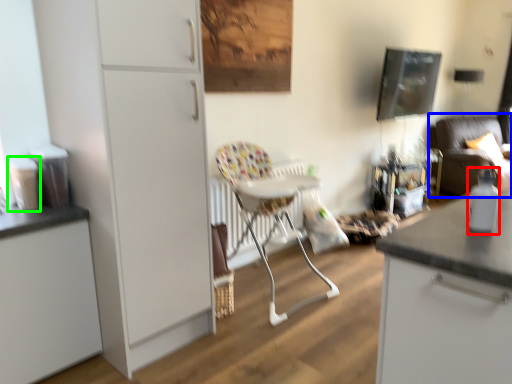
Question: Which object is the closest to the bottle (highlighted by a red box)? Choose among these: studio couch (highlighted by a blue box) or appliance (highlighted by a green box).

Choices:
 (A) studio couch
 (B) appliance

Answer: (B)